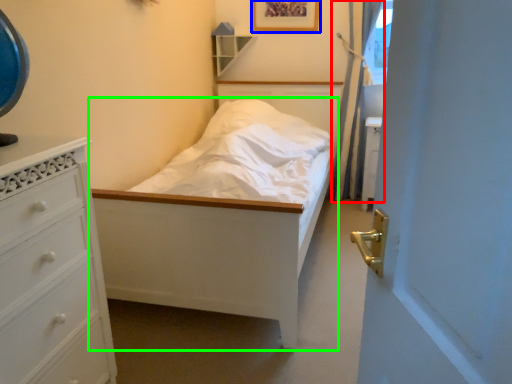
Question: Which object is the closest to the curtain (highlighted by a red box)? Choose among these: picture frame (highlighted by a blue box) or bed (highlighted by a green box).

Choices:
 (A) picture frame
 (B) bed

Answer: (A)